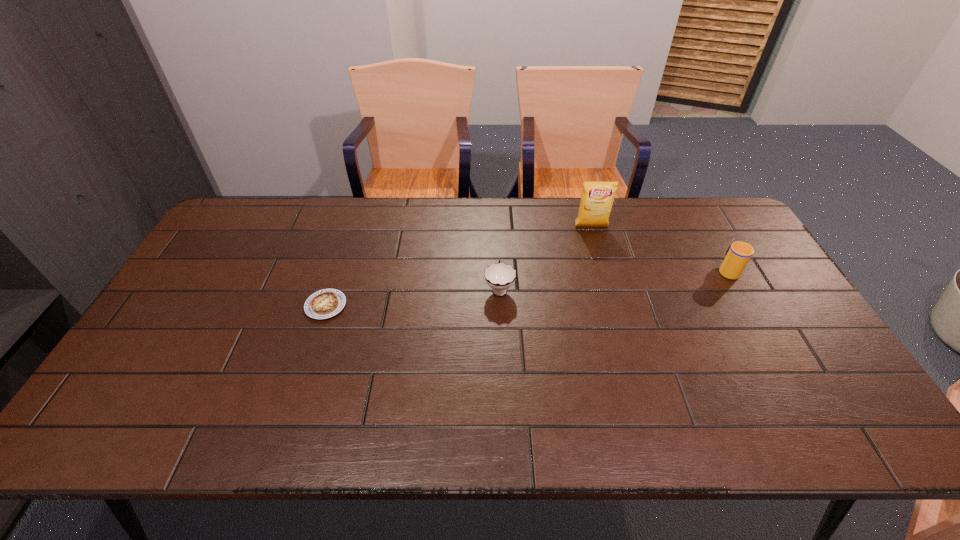
Identify the location of the tallest object. (597, 199).

Image resolution: width=960 pixels, height=540 pixels. Find the location of `crisp (potato chip)`. crisp (potato chip) is located at coordinates (597, 199).

At what (x,y) coordinates should I click in order to perform the action: click on the rightmost object. Please return your answer as a coordinate pair (x, y). The image size is (960, 540). Looking at the image, I should click on (738, 254).

Image resolution: width=960 pixels, height=540 pixels. In order to click on the right cup in this screenshot , I will do `click(738, 254)`.

Locate an element on the screen. the third tallest object is located at coordinates (500, 276).

The height and width of the screenshot is (540, 960). I want to click on the third object from right to left, so click(x=500, y=276).

The image size is (960, 540). Find the location of `the leftmost object`. the leftmost object is located at coordinates (325, 303).

I want to click on quiche, so click(325, 303).

Locate an element on the screen. This screenshot has height=540, width=960. vacant space located on the front of the second object from right to left with the logo is located at coordinates (608, 286).

Locate an element on the screen. Image resolution: width=960 pixels, height=540 pixels. free space located 0.240m on the side of the taller cup with the handle is located at coordinates (696, 214).